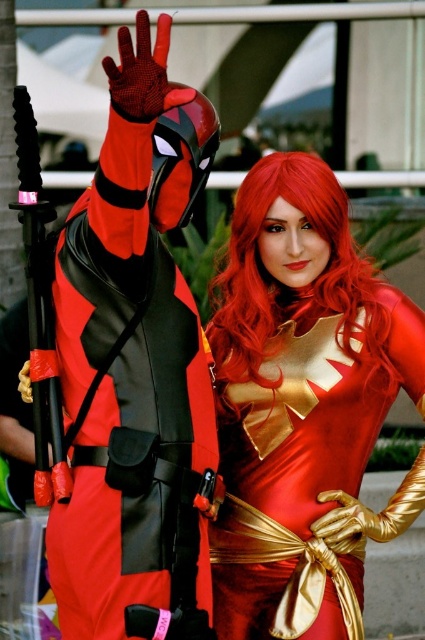
You are a photographer at a cosplay event and need to capture a closeup of both the satin gold dress at center and the shiny red wig at center. Since your camera can only focus on one object at a time, which object should you focus on first to ensure it appears in focus when the other is slightly blurred?

The satin gold dress at center is larger in size than the shiny red wig at center, so focusing on the larger satin gold dress at center first will ensure it remains sharp even if the smaller shiny red wig at center is slightly out of focus.

You are a photographer at the event and need to position a spotlight exactly at the center of the satin gold dress at center. What are the coordinates where you should place the spotlight?

The coordinates for the center of the satin gold dress at center are at point (303,404).

You are a photographer at the event and need to capture a closeup shot of the shiny red wig at center and the satin gold dress at center. What is the minimum distance you need to maintain between the camera and the subjects to ensure both are in focus?

The minimum distance required to ensure both the shiny red wig at center and the satin gold dress at center are in focus is 7.20 inches, as they are positioned 7.20 inches apart.